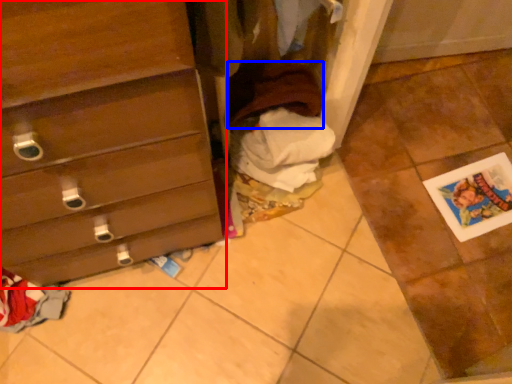
Question: Which point is closer to the camera, chest of drawers (highlighted by a red box) or clothing (highlighted by a blue box)?

Choices:
 (A) chest of drawers
 (B) clothing

Answer: (A)